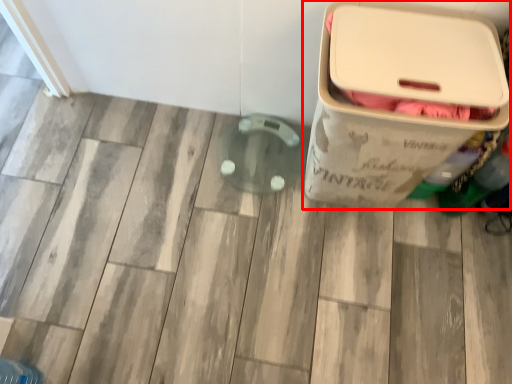
Question: Observing the image, what is the correct spatial positioning of waste container (annotated by the red box) in reference to bottle?

Choices:
 (A) left
 (B) right

Answer: (A)